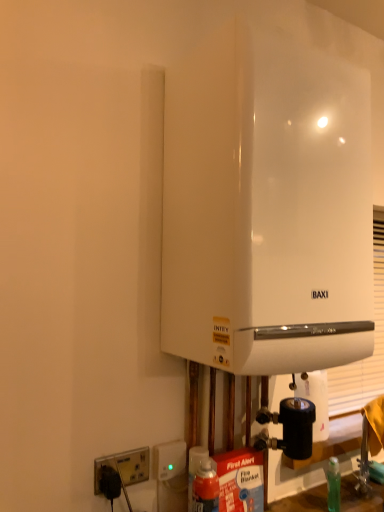
What is the approximate height of white matte paper towel at lower right?

9.62 inches.

The height and width of the screenshot is (512, 384). Describe the element at coordinates (266, 207) in the screenshot. I see `white glossy boiler at center` at that location.

Measure the distance between white plastic socket at lower left, arranged as the second electric outlet when viewed from the right, and camera.

The depth of white plastic socket at lower left, arranged as the second electric outlet when viewed from the right, is 3.34 feet.

Find the location of a particular element. The image size is (384, 512). white matte paper towel at lower right is located at coordinates (306, 397).

From the image's perspective, relative to white glossy boiler at center, is white plastic socket at lower left, arranged as the second electric outlet when viewed from the right, above or below?

From the image's perspective, white plastic socket at lower left, arranged as the second electric outlet when viewed from the right, appears below white glossy boiler at center.

Is the position of white plastic socket at lower left, arranged as the second electric outlet when viewed from the right, more distant than that of white glossy boiler at center?

Yes.

Is white plastic socket at lower left, arranged as the second electric outlet when viewed from the right, facing towards white glossy boiler at center?

No.

From the picture: Considering the sizes of objects white plastic socket at lower left, arranged as the second electric outlet when viewed from the right, and white glossy boiler at center in the image provided, who is smaller, white plastic socket at lower left, arranged as the second electric outlet when viewed from the right, or white glossy boiler at center?

With smaller size is white plastic socket at lower left, arranged as the second electric outlet when viewed from the right.

How many degrees apart are the facing directions of white glossy boiler at center and white plastic socket at lower left, which is the second electric outlet from left to right?

There is a 0.00219-degree angle between the facing directions of white glossy boiler at center and white plastic socket at lower left, which is the second electric outlet from left to right.

Which is more to the left, white glossy boiler at center or white plastic socket at lower left, which is the second electric outlet from left to right?

From the viewer's perspective, white plastic socket at lower left, which is the second electric outlet from left to right, appears more on the left side.

Which of these two, white glossy boiler at center or white plastic socket at lower left, the 1th electric outlet in the right-to-left sequence, is smaller?

white plastic socket at lower left, the 1th electric outlet in the right-to-left sequence, is smaller.

Which is in front, white glossy boiler at center or white plastic socket at lower left, the 1th electric outlet in the right-to-left sequence?

white glossy boiler at center.

Is white plastic socket at lower left, placed as the first electric outlet when sorted from left to right, positioned with its back to white plastic socket at lower left, which is the second electric outlet from left to right?

white plastic socket at lower left, placed as the first electric outlet when sorted from left to right, is not turned away from white plastic socket at lower left, which is the second electric outlet from left to right.

From a real-world perspective, is white plastic socket at lower left, placed as the first electric outlet when sorted from left to right, located higher than white plastic socket at lower left, which is the second electric outlet from left to right?

No, from a real-world perspective, white plastic socket at lower left, placed as the first electric outlet when sorted from left to right, is not above white plastic socket at lower left, which is the second electric outlet from left to right.

Is the surface of white plastic socket at lower left, placed as the first electric outlet when sorted from left to right, in direct contact with white plastic socket at lower left, the 1th electric outlet in the right-to-left sequence?

Yes, white plastic socket at lower left, placed as the first electric outlet when sorted from left to right, is with white plastic socket at lower left, the 1th electric outlet in the right-to-left sequence.

Does white plastic socket at lower left, placed as the first electric outlet when sorted from left to right, have a smaller size compared to white plastic socket at lower left, which is the second electric outlet from left to right?

Yes.

Is white plastic socket at lower left, placed as the first electric outlet when sorted from left to right, in front of or behind white matte paper towel at lower right in the image?

Visually, white plastic socket at lower left, placed as the first electric outlet when sorted from left to right, is located in front of white matte paper towel at lower right.

Is white plastic socket at lower left, placed as the first electric outlet when sorted from left to right, not near white matte paper towel at lower right?

white plastic socket at lower left, placed as the first electric outlet when sorted from left to right, is actually quite close to white matte paper towel at lower right.

Identify the location of the 2nd electric outlet directly beneath the white matte paper towel at lower right (from a real-world perspective). The width and height of the screenshot is (384, 512). (124, 467).

Can you confirm if white plastic socket at lower left, placed as the first electric outlet when sorted from left to right, is wider than white matte paper towel at lower right?

Incorrect, the width of white plastic socket at lower left, placed as the first electric outlet when sorted from left to right, does not surpass that of white matte paper towel at lower right.

From a real-world perspective, is white matte paper towel at lower right positioned above or below white plastic socket at lower left, which is the second electric outlet from left to right?

white matte paper towel at lower right is situated higher than white plastic socket at lower left, which is the second electric outlet from left to right, in the real world.

This screenshot has width=384, height=512. I want to click on paper towel located above the white plastic socket at lower left, the 1th electric outlet in the right-to-left sequence (from the image's perspective), so click(306, 397).

Considering the relative positions of white matte paper towel at lower right and white plastic socket at lower left, the 1th electric outlet in the right-to-left sequence, in the image provided, is white matte paper towel at lower right to the left of white plastic socket at lower left, the 1th electric outlet in the right-to-left sequence, from the viewer's perspective?

In fact, white matte paper towel at lower right is to the right of white plastic socket at lower left, the 1th electric outlet in the right-to-left sequence.

Could white plastic socket at lower left, placed as the first electric outlet when sorted from left to right, be considered to be inside white matte paper towel at lower right?

No.

Is white matte paper towel at lower right wider than white plastic socket at lower left, arranged as the second electric outlet when viewed from the right?

Indeed, white matte paper towel at lower right has a greater width compared to white plastic socket at lower left, arranged as the second electric outlet when viewed from the right.

How different are the orientations of white matte paper towel at lower right and white plastic socket at lower left, placed as the first electric outlet when sorted from left to right, in degrees?

The facing directions of white matte paper towel at lower right and white plastic socket at lower left, placed as the first electric outlet when sorted from left to right, are 0.0291 degrees apart.

Considering the sizes of objects white matte paper towel at lower right and white plastic socket at lower left, placed as the first electric outlet when sorted from left to right, in the image provided, who is smaller, white matte paper towel at lower right or white plastic socket at lower left, placed as the first electric outlet when sorted from left to right,?

white plastic socket at lower left, placed as the first electric outlet when sorted from left to right, is smaller.

In the image, there is a white plastic socket at lower left, placed as the first electric outlet when sorted from left to right. Identify the location of electric outlet above it (from the image's perspective). The width and height of the screenshot is (384, 512). (169, 459).

Which of these two, white plastic socket at lower left, which is the second electric outlet from left to right, or white plastic socket at lower left, placed as the first electric outlet when sorted from left to right, is thinner?

Thinner between the two is white plastic socket at lower left, placed as the first electric outlet when sorted from left to right.

How much distance is there between white plastic socket at lower left, the 1th electric outlet in the right-to-left sequence, and white plastic socket at lower left, arranged as the second electric outlet when viewed from the right?

white plastic socket at lower left, the 1th electric outlet in the right-to-left sequence, and white plastic socket at lower left, arranged as the second electric outlet when viewed from the right, are 2.97 inches apart.

Is white plastic socket at lower left, the 1th electric outlet in the right-to-left sequence, in contact with white plastic socket at lower left, placed as the first electric outlet when sorted from left to right?

Yes, white plastic socket at lower left, the 1th electric outlet in the right-to-left sequence, and white plastic socket at lower left, placed as the first electric outlet when sorted from left to right, clearly make contact.

The width and height of the screenshot is (384, 512). In order to click on home appliance that is above the white plastic socket at lower left, arranged as the second electric outlet when viewed from the right (from the image's perspective) in this screenshot , I will do `click(266, 207)`.

Where is `electric outlet that is the 1st one when counting leftward from the white glossy boiler at center`? The height and width of the screenshot is (512, 384). electric outlet that is the 1st one when counting leftward from the white glossy boiler at center is located at coordinates (169, 459).

Considering their positions, is white plastic socket at lower left, arranged as the second electric outlet when viewed from the right, positioned closer to white glossy boiler at center than white plastic socket at lower left, the 1th electric outlet in the right-to-left sequence?

white plastic socket at lower left, the 1th electric outlet in the right-to-left sequence, lies closer to white glossy boiler at center than the other object.

Estimate the real-world distances between objects in this image. Which object is closer to white glossy boiler at center, white plastic socket at lower left, the 1th electric outlet in the right-to-left sequence, or white plastic socket at lower left, placed as the first electric outlet when sorted from left to right?

Based on the image, white plastic socket at lower left, the 1th electric outlet in the right-to-left sequence, appears to be nearer to white glossy boiler at center.

Looking at the image, which one is located closer to white plastic socket at lower left, arranged as the second electric outlet when viewed from the right, white matte paper towel at lower right or white glossy boiler at center?

white matte paper towel at lower right.

Estimate the real-world distances between objects in this image. Which object is further from white plastic socket at lower left, the 1th electric outlet in the right-to-left sequence, white matte paper towel at lower right or white glossy boiler at center?

white glossy boiler at center lies further to white plastic socket at lower left, the 1th electric outlet in the right-to-left sequence, than the other object.

When comparing their distances from white plastic socket at lower left, the 1th electric outlet in the right-to-left sequence, does white glossy boiler at center or white matte paper towel at lower right seem closer?

white matte paper towel at lower right.

Based on their spatial positions, is white plastic socket at lower left, the 1th electric outlet in the right-to-left sequence, or white matte paper towel at lower right closer to white glossy boiler at center?

Among the two, white matte paper towel at lower right is located nearer to white glossy boiler at center.

From the image, which object appears to be nearer to white glossy boiler at center, white matte paper towel at lower right or white plastic socket at lower left, arranged as the second electric outlet when viewed from the right?

white matte paper towel at lower right is closer to white glossy boiler at center.

Which object lies nearer to the anchor point white plastic socket at lower left, arranged as the second electric outlet when viewed from the right, white matte paper towel at lower right or white plastic socket at lower left, which is the second electric outlet from left to right?

Based on the image, white plastic socket at lower left, which is the second electric outlet from left to right, appears to be nearer to white plastic socket at lower left, arranged as the second electric outlet when viewed from the right.

This screenshot has width=384, height=512. Identify the location of electric outlet between white plastic socket at lower left, arranged as the second electric outlet when viewed from the right, and white matte paper towel at lower right. (169, 459).

Identify the location of paper towel between white glossy boiler at center and white plastic socket at lower left, arranged as the second electric outlet when viewed from the right, from top to bottom. (306, 397).

Locate an element on the screen. paper towel between white glossy boiler at center and white plastic socket at lower left, the 1th electric outlet in the right-to-left sequence, in the vertical direction is located at coordinates (306, 397).

Locate an element on the screen. Image resolution: width=384 pixels, height=512 pixels. electric outlet between white glossy boiler at center and white plastic socket at lower left, placed as the first electric outlet when sorted from left to right, vertically is located at coordinates (169, 459).